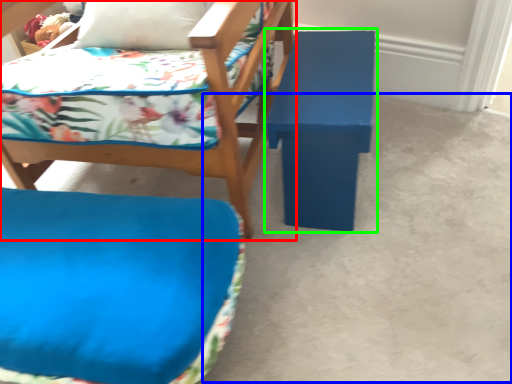
Question: Considering the real-world distances, which object is farthest from chair (highlighted by a red box)? concrete (highlighted by a blue box) or table (highlighted by a green box)?

Choices:
 (A) concrete
 (B) table

Answer: (A)